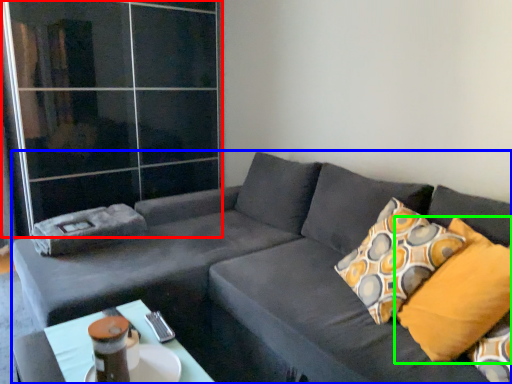
Question: Estimate the real-world distances between objects in this image. Which object is closer to glass door (highlighted by a red box), studio couch (highlighted by a blue box) or pillow (highlighted by a green box)?

Choices:
 (A) studio couch
 (B) pillow

Answer: (A)